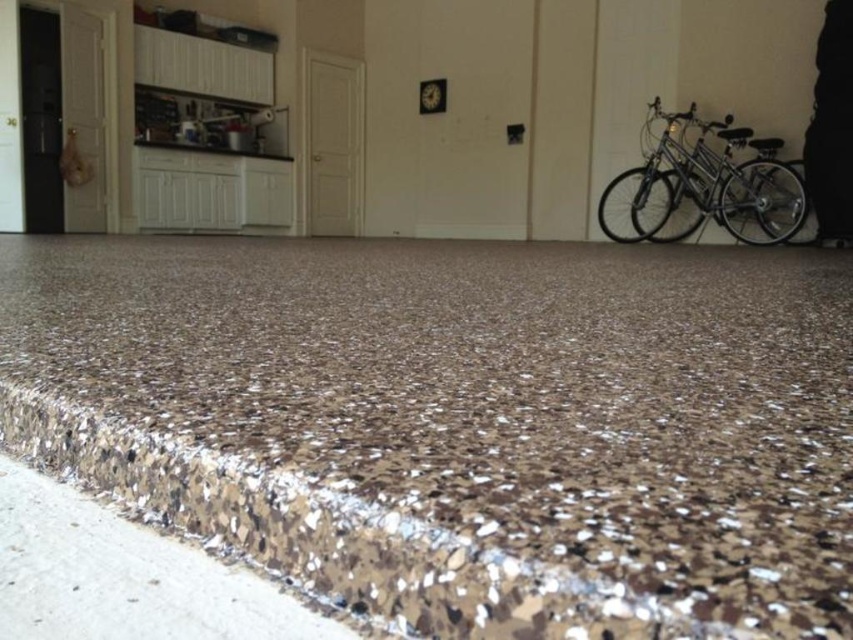
You are standing in the room and want to determine the distance between two points marked in the image. The first point is at coordinate point(53, 275) and the second is at point(697, 204). Based on the scene description, which point is closer to you?

Point(53, 275) is closer to the viewer than point(697, 204).

You are moving a large piece of furniture that requires a surface at least 2 inches thick. You see the brown speckled concrete at lower left and the brown speckled granite counter top at upper left. Which surface can support the furniture?

The brown speckled granite counter top at upper left is thicker than the brown speckled concrete at lower left, so it can support the furniture.